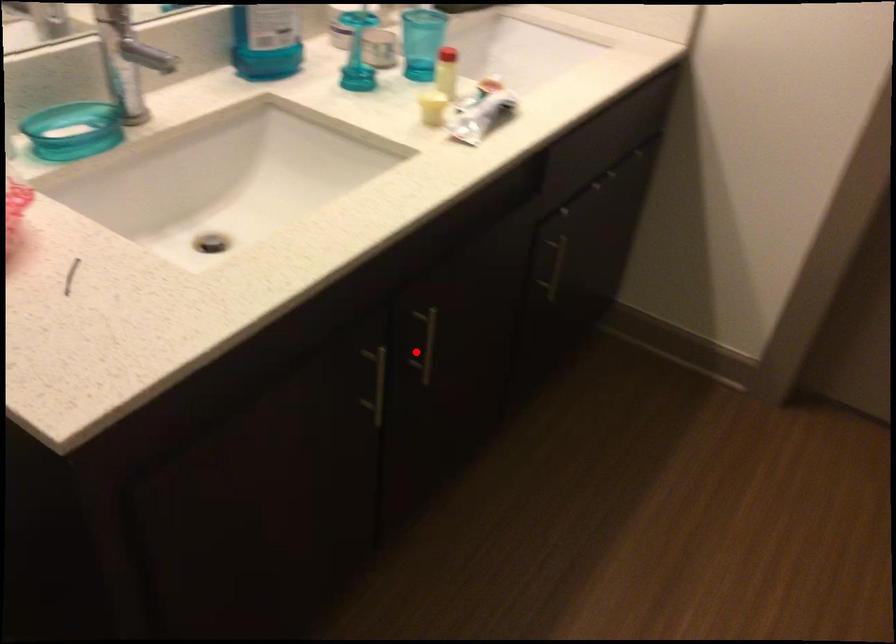
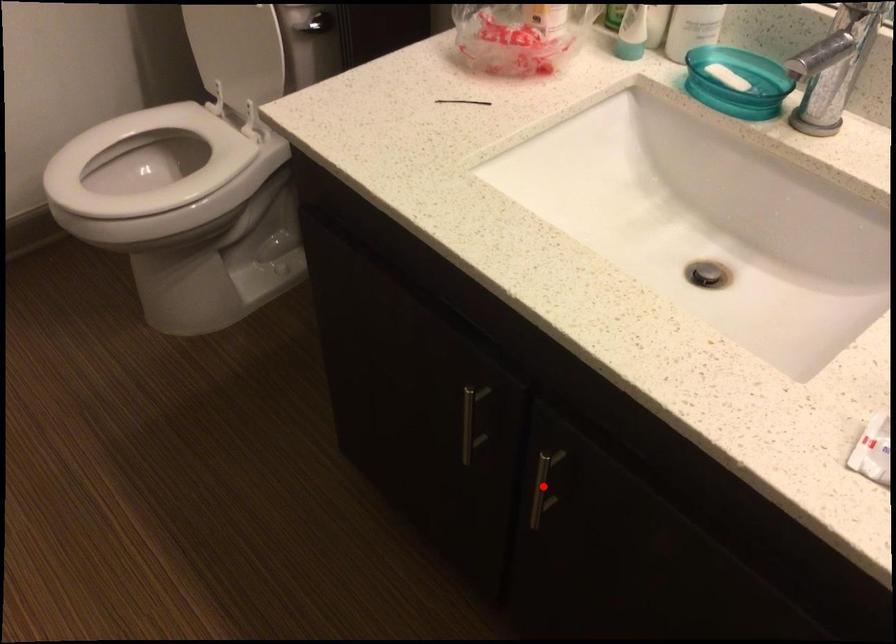
I am providing you with two images of the same scene from different viewpoints. A red point is marked on the first image and another point is marked on the second image. Is the marked point in image1 the same physical position as the marked point in image2?

Yes